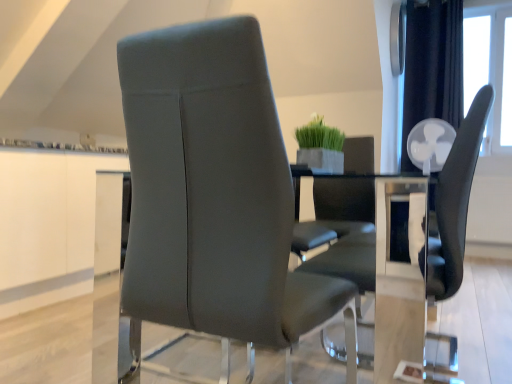
Question: Does satin gray leather chair at center, the 2th chair when ordered from right to left, have a lesser width compared to clear glass table at center?

Choices:
 (A) no
 (B) yes

Answer: (B)

Question: From a real-world perspective, is satin gray leather chair at center, the first chair viewed from the left, positioned over clear glass table at center based on gravity?

Choices:
 (A) no
 (B) yes

Answer: (B)

Question: Can you confirm if satin gray leather chair at center, the first chair viewed from the left, is bigger than clear glass table at center?

Choices:
 (A) yes
 (B) no

Answer: (B)

Question: Could you tell me if satin gray leather chair at center, the first chair viewed from the left, is facing clear glass table at center?

Choices:
 (A) yes
 (B) no

Answer: (A)

Question: Is satin gray leather chair at center, the first chair viewed from the left, beside clear glass table at center?

Choices:
 (A) yes
 (B) no

Answer: (B)

Question: From the image's perspective, is satin gray leather chair at center, the first chair viewed from the left, above or below clear glass table at center?

Choices:
 (A) above
 (B) below

Answer: (A)

Question: Based on their positions, is satin gray leather chair at center, the first chair viewed from the left, located to the left or right of clear glass table at center?

Choices:
 (A) left
 (B) right

Answer: (A)

Question: Is satin gray leather chair at center, the 2th chair when ordered from right to left, wider or thinner than clear glass table at center?

Choices:
 (A) thin
 (B) wide

Answer: (A)

Question: Is point (126, 306) positioned closer to the camera than point (321, 241)?

Choices:
 (A) farther
 (B) closer

Answer: (B)

Question: Is transparent glass window at upper right in front of or behind clear glass table at center in the image?

Choices:
 (A) behind
 (B) front

Answer: (A)

Question: From the image's perspective, relative to clear glass table at center, is transparent glass window at upper right above or below?

Choices:
 (A) above
 (B) below

Answer: (A)

Question: Looking at the image, does transparent glass window at upper right seem bigger or smaller compared to clear glass table at center?

Choices:
 (A) big
 (B) small

Answer: (B)

Question: Is point (497, 49) closer or farther from the camera than point (104, 256)?

Choices:
 (A) farther
 (B) closer

Answer: (A)

Question: From a real-world perspective, relative to green matte plant at center, is matte black chair at center, placed as the 2th chair when sorted from left to right, vertically above or below?

Choices:
 (A) below
 (B) above

Answer: (A)

Question: Does point (429, 251) appear closer or farther from the camera than point (298, 137)?

Choices:
 (A) farther
 (B) closer

Answer: (B)